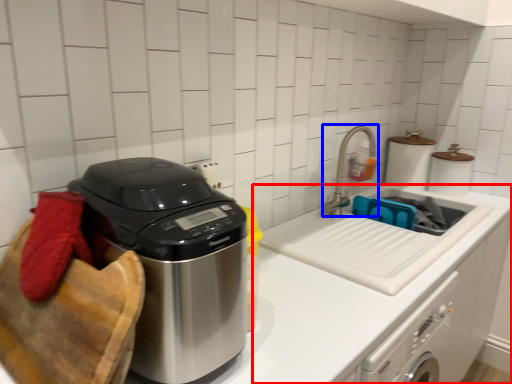
Question: Which object is closer to the camera taking this photo, counter (highlighted by a red box) or faucet (highlighted by a blue box)?

Choices:
 (A) counter
 (B) faucet

Answer: (A)